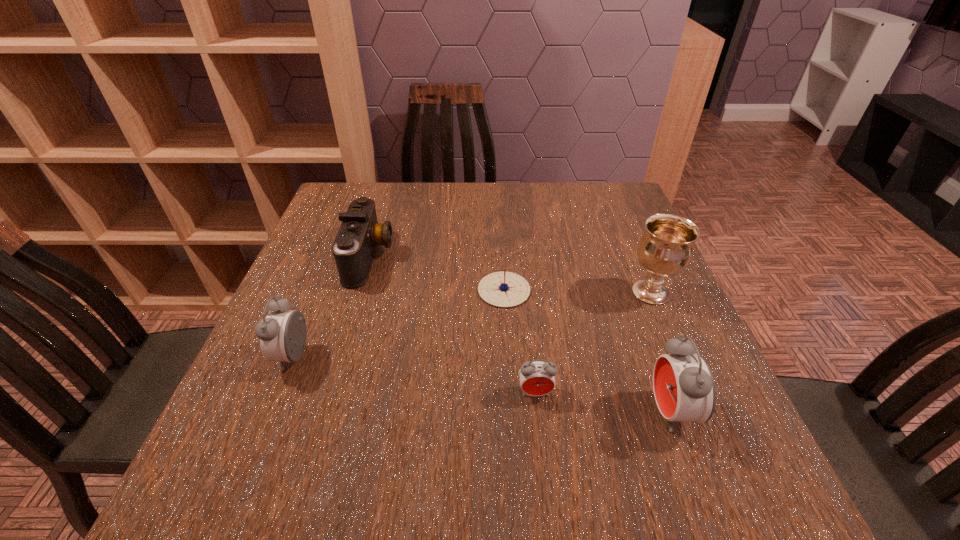
I want to click on alarm clock object that ranks as the closest to the rightmost alarm clock, so click(537, 378).

Find the location of a particular element. This screenshot has height=540, width=960. vacant space that satisfies the following two spatial constraints: 1. on the lens of the chalice; 2. on the right side of the second object from left to right is located at coordinates (358, 293).

Where is `vacant point that satisfies the following two spatial constraints: 1. on the lens of the fifth object from right to left; 2. on the left side of the compass`? vacant point that satisfies the following two spatial constraints: 1. on the lens of the fifth object from right to left; 2. on the left side of the compass is located at coordinates (359, 290).